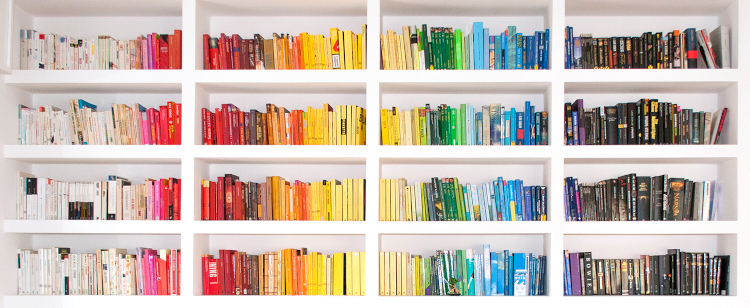
In order to click on white book sections in this screenshot , I will do `click(69, 52)`, `click(72, 125)`, `click(78, 199)`, `click(80, 263)`.